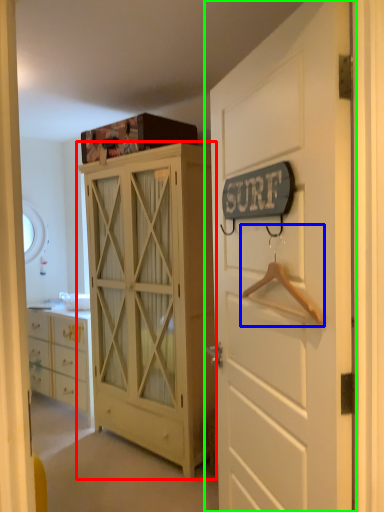
Question: Estimate the real-world distances between objects in this image. Which object is farther from cabinetry (highlighted by a red box), hanger (highlighted by a blue box) or door (highlighted by a green box)?

Choices:
 (A) hanger
 (B) door

Answer: (A)